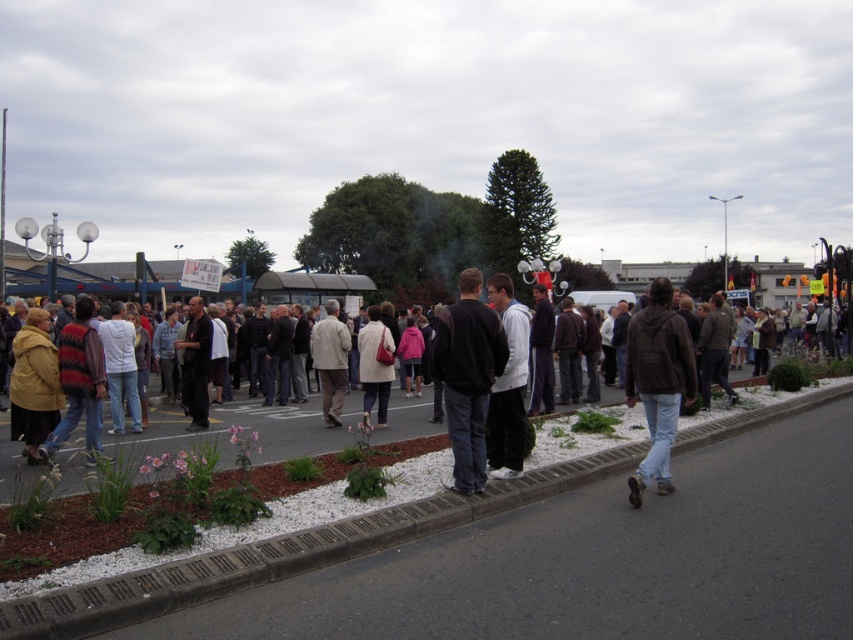
Question: Does dark gray hoodie at center have a larger size compared to matte yellow jacket at left?

Choices:
 (A) yes
 (B) no

Answer: (B)

Question: Which point appears closest to the camera in this image?

Choices:
 (A) click(184, 356)
 (B) click(628, 387)

Answer: (B)

Question: Does smooth concrete pavement at center have a smaller size compared to beige fabric jacket at center?

Choices:
 (A) yes
 (B) no

Answer: (B)

Question: Which point is closer to the camera?

Choices:
 (A) dark brown leather jacket at center
 (B) brown leather jacket at lower right

Answer: (B)

Question: Does brown leather jacket at lower right appear over matte beige coat at center?

Choices:
 (A) no
 (B) yes

Answer: (B)

Question: Which object appears closest to the camera in this image?

Choices:
 (A) brown leather jacket at lower right
 (B) dark gray hoodie at center
 (C) beige fabric jacket at center

Answer: (B)